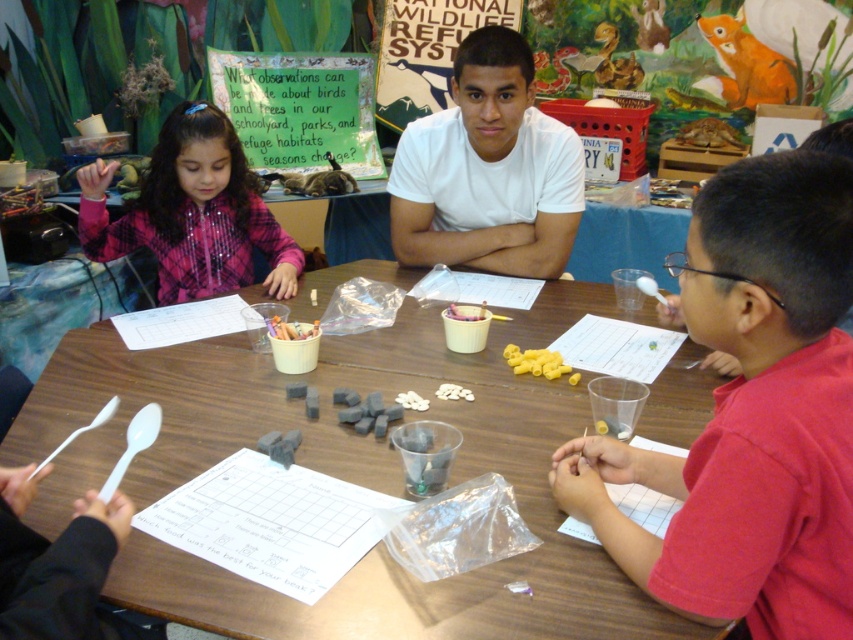
Question: Among these points, which one is nearest to the camera?

Choices:
 (A) (355, 129)
 (B) (477, 310)
 (C) (193, 196)

Answer: (B)

Question: Can you confirm if green paper sign at upper center is positioned to the left of white plastic cup at center?

Choices:
 (A) yes
 (B) no

Answer: (A)

Question: Which point appears closest to the camera in this image?

Choices:
 (A) (715, 252)
 (B) (612, 589)
 (C) (165, 296)
 (D) (415, 115)

Answer: (A)

Question: Is smooth plastic spoon at upper right to the right of pink plaid shirt at upper left from the viewer's perspective?

Choices:
 (A) yes
 (B) no

Answer: (A)

Question: Which of the following is the farthest from the observer?

Choices:
 (A) (280, 257)
 (B) (833, 184)

Answer: (A)

Question: Observing the image, what is the correct spatial positioning of yellow matte pasta at center in reference to white matte cupcake at center?

Choices:
 (A) below
 (B) above

Answer: (A)